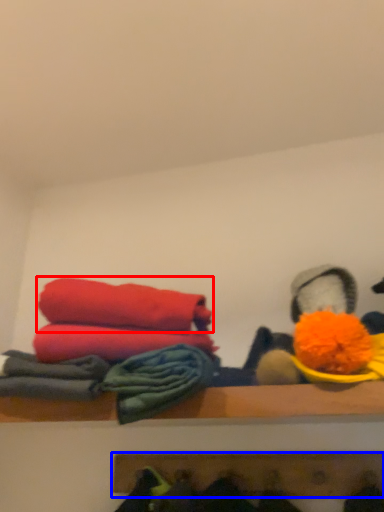
Question: Which object appears farthest to the camera in this image, towel (highlighted by a red box) or shelf (highlighted by a blue box)?

Choices:
 (A) towel
 (B) shelf

Answer: (B)